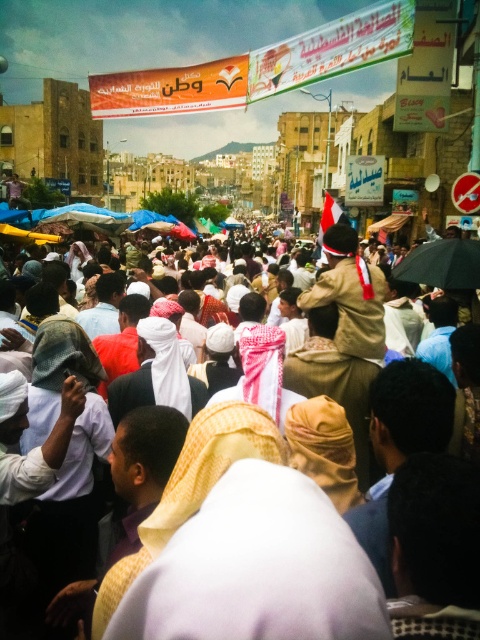
Does white cloth at center appear over black matte umbrella at center?

Incorrect, white cloth at center is not positioned above black matte umbrella at center.

Where is `white cloth at center`? The image size is (480, 640). white cloth at center is located at coordinates (247, 579).